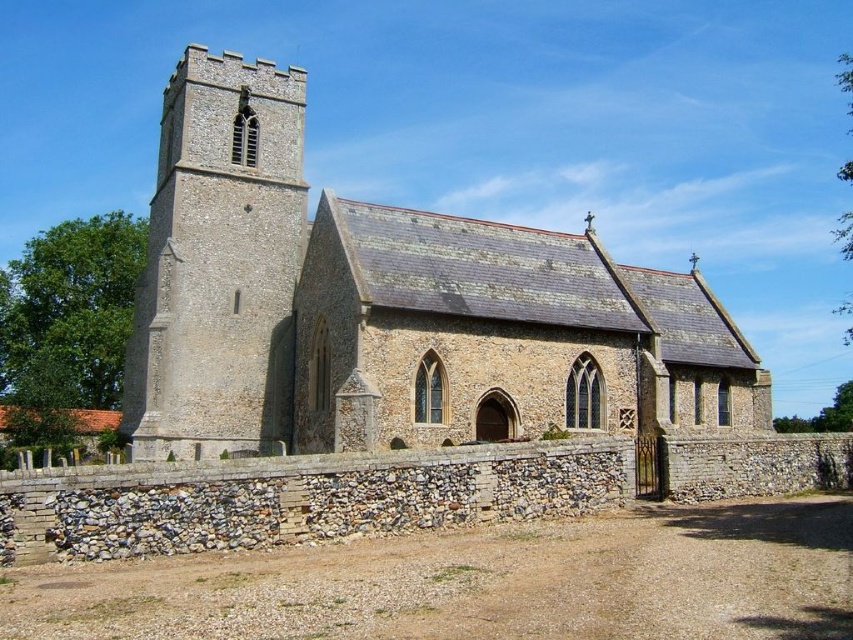
Question: Which of the following is the closest to the observer?

Choices:
 (A) (234, 323)
 (B) (552, 417)

Answer: (B)

Question: Among these points, which one is nearest to the camera?

Choices:
 (A) (440, 362)
 (B) (238, 93)

Answer: (A)

Question: Is brown stone church at center positioned in front of stone tower at upper left?

Choices:
 (A) yes
 (B) no

Answer: (A)

Question: Does brown stone church at center appear under stone tower at upper left?

Choices:
 (A) no
 (B) yes

Answer: (B)

Question: Which object appears closest to the camera in this image?

Choices:
 (A) stone tower at upper left
 (B) brown stone church at center

Answer: (B)

Question: Does brown stone church at center appear over stone tower at upper left?

Choices:
 (A) no
 (B) yes

Answer: (A)